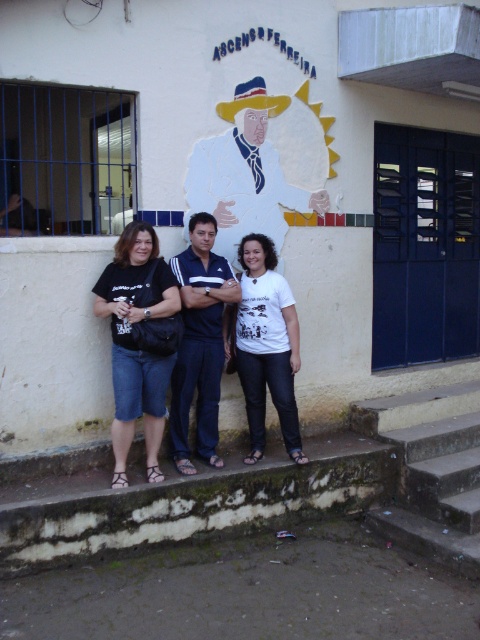
Question: Which point appears farthest from the camera in this image?

Choices:
 (A) (206, 460)
 (B) (162, 365)
 (C) (278, 248)
 (D) (435, 513)

Answer: (C)

Question: From the image, what is the correct spatial relationship of matte white cowboy hat at center in relation to concrete stairs at lower right?

Choices:
 (A) below
 (B) above

Answer: (B)

Question: Does concrete stairs at lower center come in front of blue fabric shirt at center?

Choices:
 (A) no
 (B) yes

Answer: (B)

Question: Which point is farther from the camera taking this photo?

Choices:
 (A) (139, 314)
 (B) (325, 445)

Answer: (B)

Question: Is concrete stairs at lower center smaller than blue fabric shirt at center?

Choices:
 (A) no
 (B) yes

Answer: (A)

Question: Which of the following is the closest to the observer?

Choices:
 (A) (173, 307)
 (B) (200, 209)
 (C) (135, 524)
 (D) (181, 288)

Answer: (C)